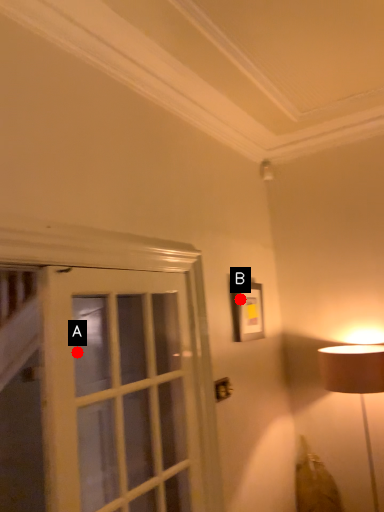
Question: Two points are circled on the image, labeled by A and B beside each circle. Which point is closer to the camera?

Choices:
 (A) A is closer
 (B) B is closer

Answer: (B)